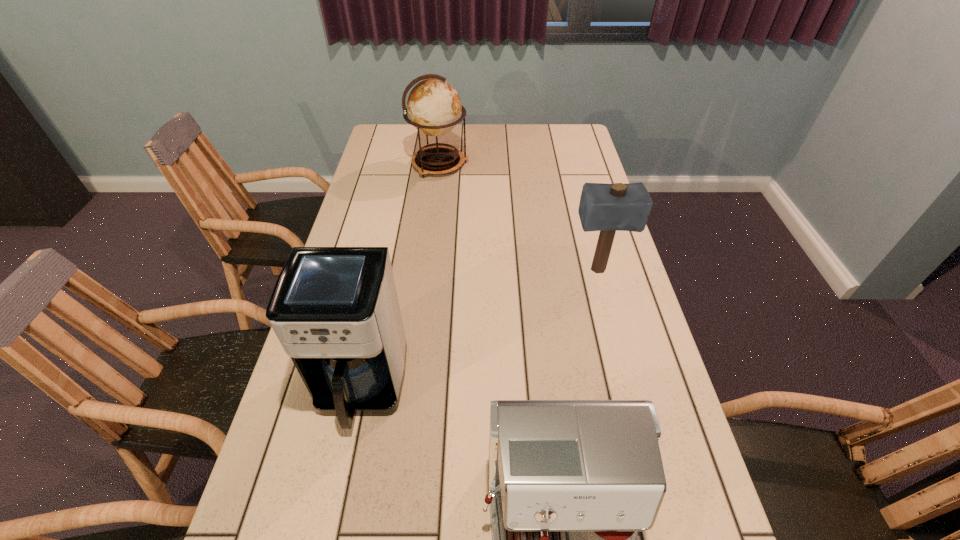
You are a GUI agent. You are given a task and a screenshot of the screen. Output one action in this format:
    pyautogui.click(x=<x>, y=<y>)
    Task: Click on the object present at the right edge
    The height and width of the screenshot is (540, 960).
    Given the screenshot: What is the action you would take?
    pyautogui.click(x=607, y=208)

Where is `object positioned at the far left corner`? object positioned at the far left corner is located at coordinates (434, 107).

You are a GUI agent. You are given a task and a screenshot of the screen. Output one action in this format:
    pyautogui.click(x=<x>, y=<y>)
    Task: Click on the free space at the far edge of the desktop
    This screenshot has width=960, height=540.
    Given the screenshot: What is the action you would take?
    pyautogui.click(x=541, y=147)

Locate an element on the screen. Image resolution: width=960 pixels, height=540 pixels. vacant region at the left edge of the desktop is located at coordinates (389, 223).

This screenshot has height=540, width=960. In the image, there is a desktop. Find the location of `vacant space at the right edge`. vacant space at the right edge is located at coordinates (564, 182).

Where is `vacant space at the far right corner of the desktop`? The width and height of the screenshot is (960, 540). vacant space at the far right corner of the desktop is located at coordinates click(x=573, y=153).

Where is `vacant point located between the left coffee maker and the mallet`? The image size is (960, 540). vacant point located between the left coffee maker and the mallet is located at coordinates (479, 329).

Identify the location of vacant area that lies between the globe and the third nearest object. (518, 217).

You are a GUI agent. You are given a task and a screenshot of the screen. Output one action in this format:
    pyautogui.click(x=<x>, y=<y>)
    Task: Click on the free space that is in between the globe and the second nearest object
    
    Given the screenshot: What is the action you would take?
    pyautogui.click(x=400, y=276)

This screenshot has height=540, width=960. What are the coordinates of `vacant point located between the globe and the left coffee maker` in the screenshot? It's located at (400, 276).